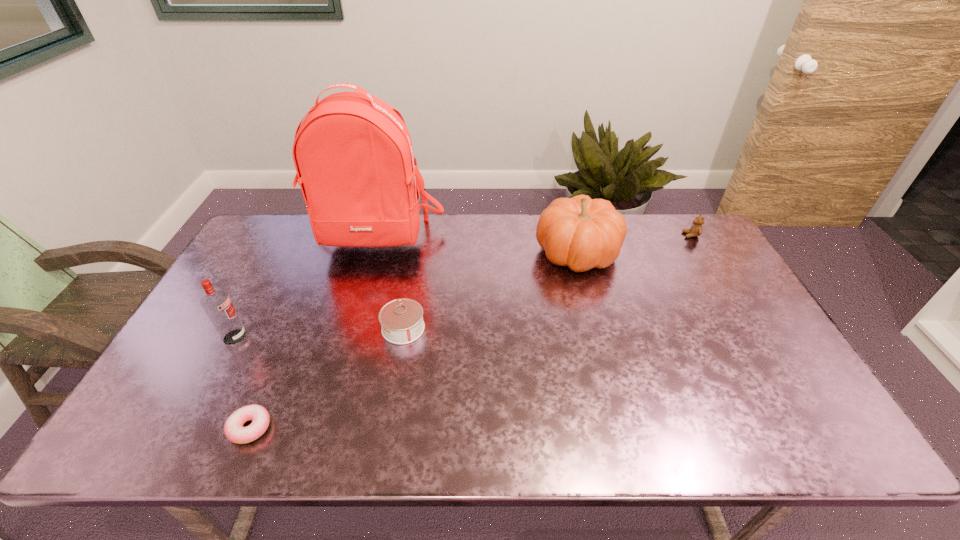
Identify the location of object that is the fourth closest to the backpack. This screenshot has width=960, height=540. (233, 428).

Locate which object ranks in proximity to the can. Please provide its 2D coordinates. Your answer should be formatted as a tuple, i.e. [(x, y)], where the tuple contains the x and y coordinates of a point satisfying the conditions above.

[(353, 154)]

This screenshot has height=540, width=960. I want to click on free space that satisfies the following two spatial constraints: 1. on the front-facing side of the third shortest object; 2. on the main compartment of the backpack, so click(x=693, y=239).

Locate an element on the screen. free space that satisfies the following two spatial constraints: 1. on the back side of the doughnut; 2. on the left side of the can is located at coordinates (292, 328).

Locate an element on the screen. vacant point that satisfies the following two spatial constraints: 1. on the main compartment of the tallest object; 2. on the front label of the vodka is located at coordinates (348, 337).

Identify the location of free space that satisfies the following two spatial constraints: 1. on the front-facing side of the rightmost object; 2. on the main compartment of the backpack. (693, 239).

The height and width of the screenshot is (540, 960). Find the location of `free space that satisfies the following two spatial constraints: 1. on the main compartment of the backpack; 2. on the right side of the fifth tallest object`. free space that satisfies the following two spatial constraints: 1. on the main compartment of the backpack; 2. on the right side of the fifth tallest object is located at coordinates (x=350, y=328).

Identify the location of vacant area in the image that satisfies the following two spatial constraints: 1. on the back side of the nearest object; 2. on the left side of the can. The width and height of the screenshot is (960, 540). (292, 328).